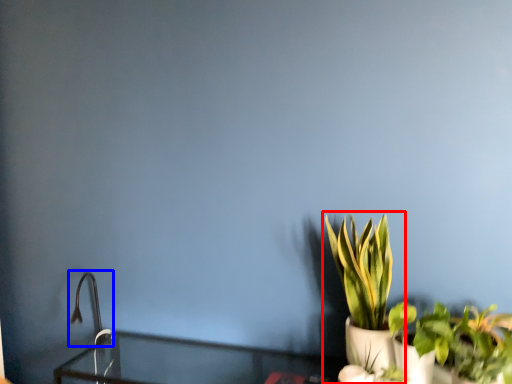
Question: Among these objects, which one is nearest to the camera, houseplant (highlighted by a red box) or faucet (highlighted by a blue box)?

Choices:
 (A) houseplant
 (B) faucet

Answer: (A)